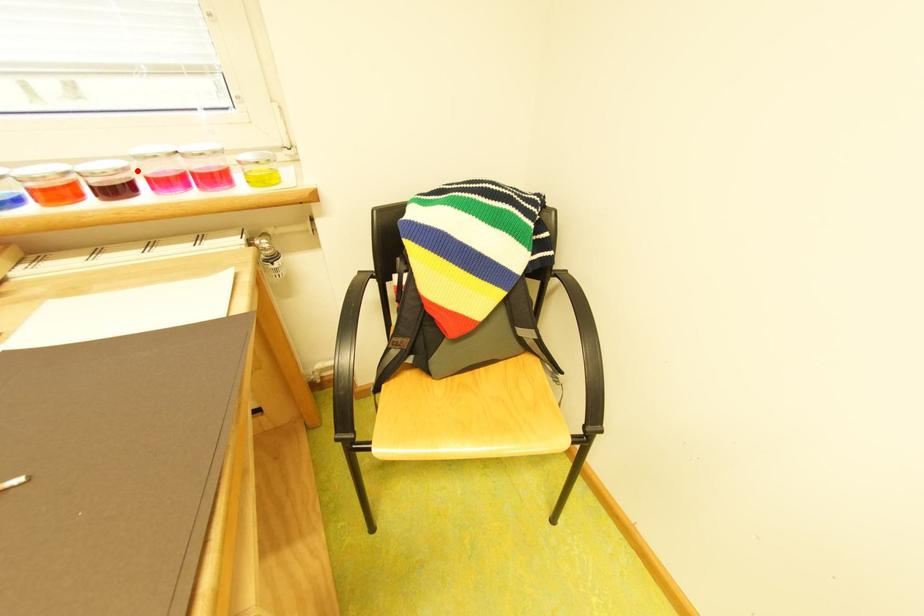
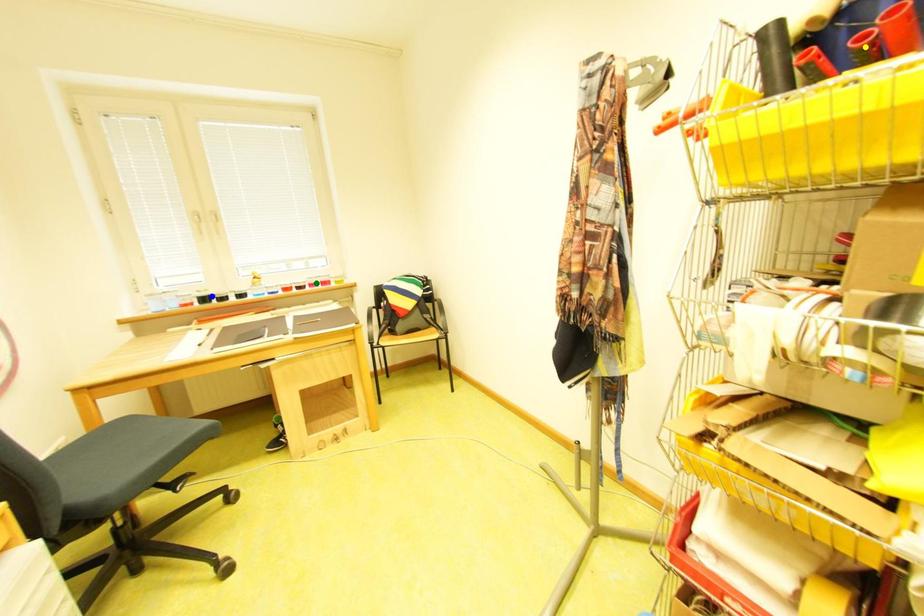
Question: I am providing you with two images of the same scene from different viewpoints. A red point is marked on the first image. You are given multiple points on the second image. Which point in image 2 represents the same 3d spot as the red point in image 1?

Choices:
 (A) blue point
 (B) yellow point
 (C) green point

Answer: (C)